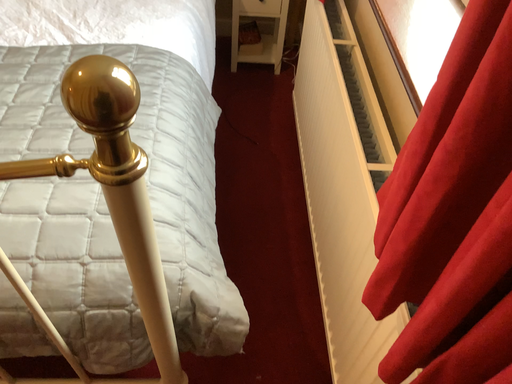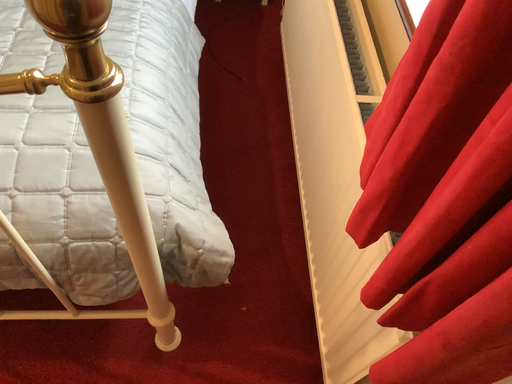
Question: How did the camera likely rotate when shooting the video?

Choices:
 (A) rotated upward
 (B) rotated downward

Answer: (B)